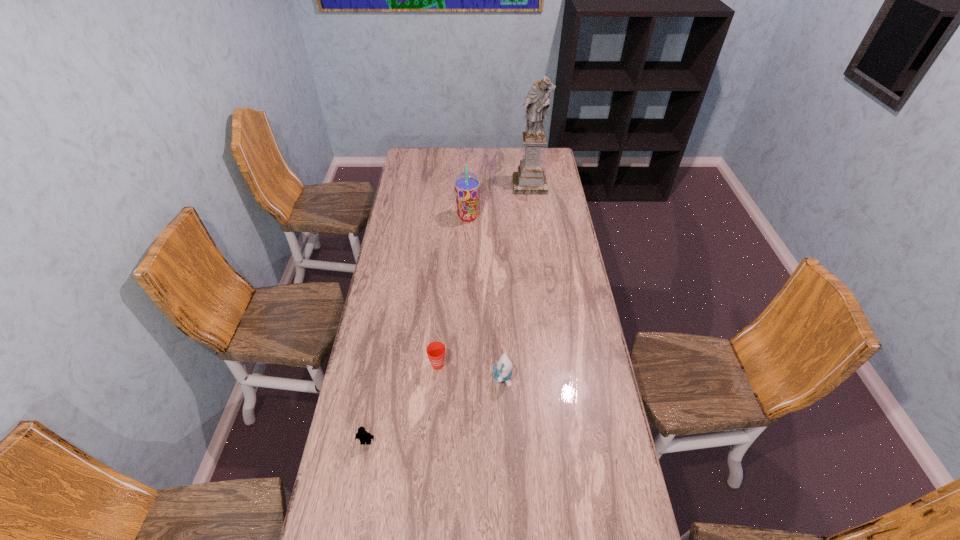
I want to click on the farthest object, so click(530, 179).

What are the coordinates of `sculpture` in the screenshot? It's located at (530, 179).

At what (x,y) coordinates should I click in order to perform the action: click on the fourth nearest object. Please return your answer as a coordinate pair (x, y). The height and width of the screenshot is (540, 960). Looking at the image, I should click on (467, 185).

Where is `the fourth shortest object`? the fourth shortest object is located at coordinates (467, 185).

At what (x,y) coordinates should I click in order to perform the action: click on kitten. Please return your answer as a coordinate pair (x, y). The image size is (960, 540). Looking at the image, I should click on (502, 371).

Where is `cup`? Image resolution: width=960 pixels, height=540 pixels. cup is located at coordinates (436, 350).

At what (x,y) coordinates should I click in order to perform the action: click on the nearest object. Please return your answer as a coordinate pair (x, y). Looking at the image, I should click on (362, 435).

What are the coordinates of `Lego` in the screenshot? It's located at (362, 435).

I want to click on blank area located 0.400m on the front-facing side of the rightmost object, so click(x=538, y=246).

You are a GUI agent. You are given a task and a screenshot of the screen. Output one action in this format:
    pyautogui.click(x=<x>, y=<y>)
    Task: Click on the vacant space located 0.160m on the left of the smoothie
    
    Given the screenshot: What is the action you would take?
    pyautogui.click(x=423, y=217)